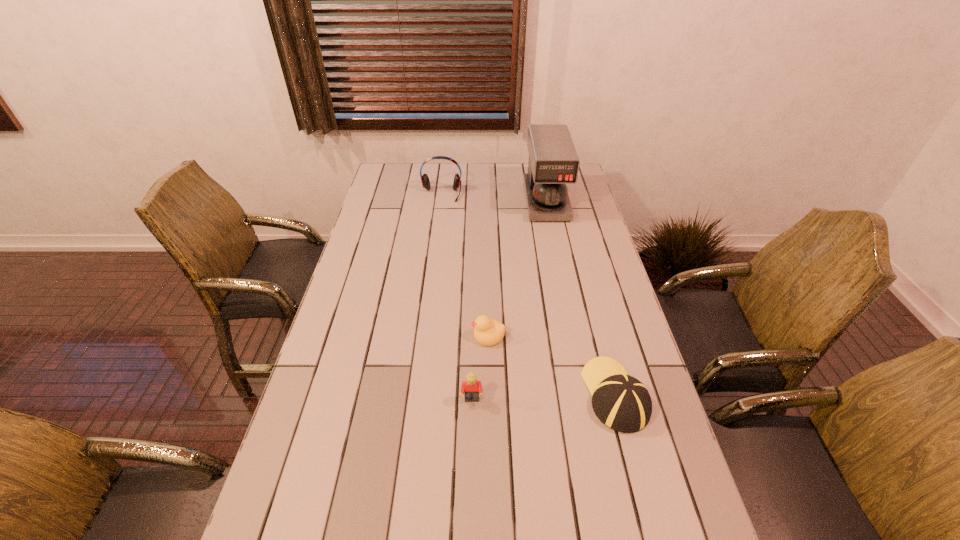
In order to click on coffee maker in this screenshot , I will do `click(553, 162)`.

Where is `headset`? This screenshot has height=540, width=960. headset is located at coordinates (425, 180).

Where is `the second tallest object`? The image size is (960, 540). the second tallest object is located at coordinates (425, 180).

Where is `Lego`? The height and width of the screenshot is (540, 960). Lego is located at coordinates coord(471,388).

You are a GUI agent. You are given a task and a screenshot of the screen. Output one action in this format:
    pyautogui.click(x=<x>, y=<y>)
    Task: Click on the baseball cap
    The height and width of the screenshot is (540, 960).
    Given the screenshot: What is the action you would take?
    pyautogui.click(x=621, y=402)

Locate an element on the screen. The width and height of the screenshot is (960, 540). the shortest object is located at coordinates (488, 332).

The width and height of the screenshot is (960, 540). Find the location of `duckling`. duckling is located at coordinates (488, 332).

Where is `blank space located on the carafe side of the coffee maker`? Image resolution: width=960 pixels, height=540 pixels. blank space located on the carafe side of the coffee maker is located at coordinates (555, 245).

The height and width of the screenshot is (540, 960). Find the location of `vacant space located with the microphone attached to the side of the headset`. vacant space located with the microphone attached to the side of the headset is located at coordinates (436, 241).

Locate an element on the screen. blank space located 0.150m on the face of the Lego is located at coordinates (470, 464).